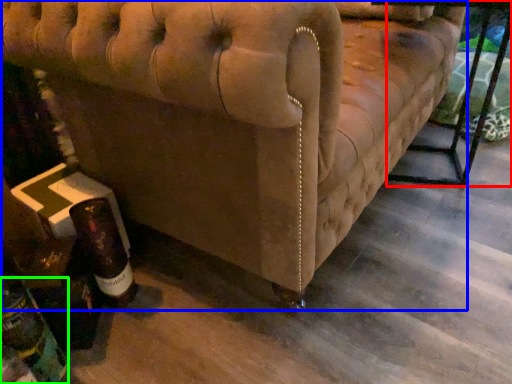
Question: Based on their relative distances, which object is farther from table (highlighted by a red box)? Choose from furniture (highlighted by a blue box) and bottle (highlighted by a green box).

Choices:
 (A) furniture
 (B) bottle

Answer: (B)